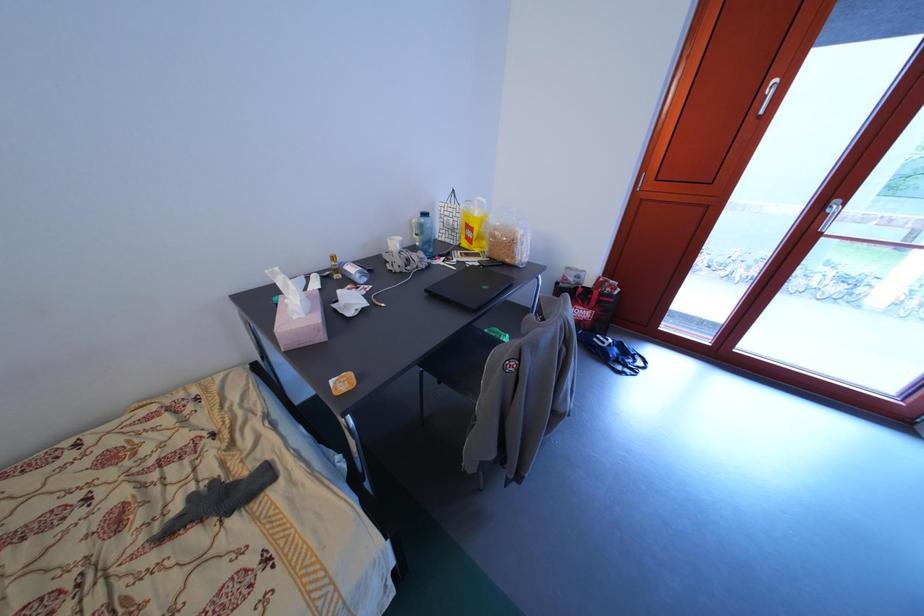
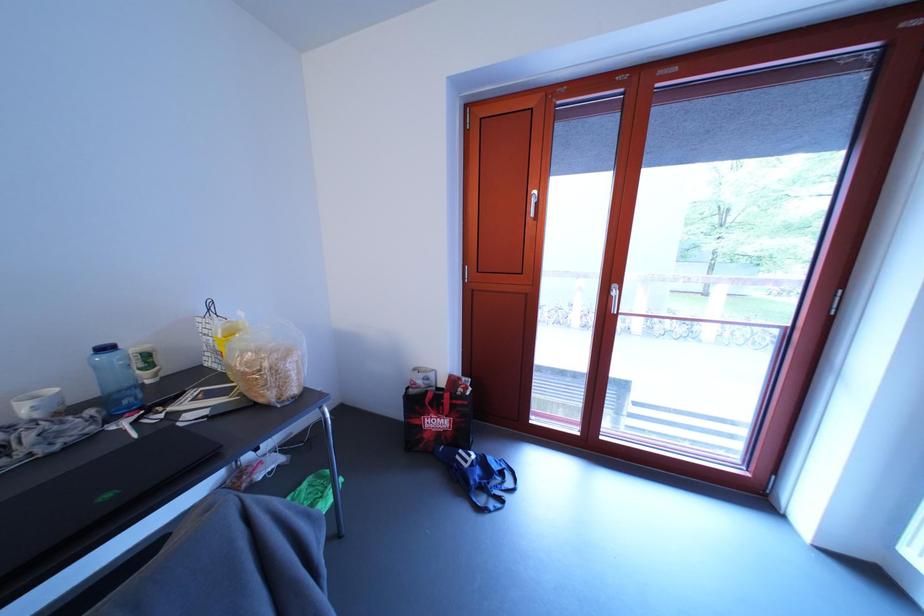
The first image is from the beginning of the video and the second image is from the end. How did the camera likely rotate when shooting the video?

The camera rotated toward right-up.